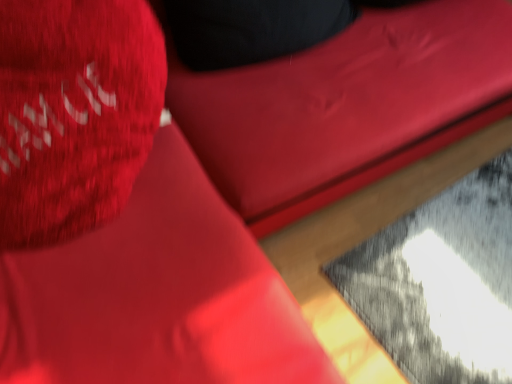
Question: Should I look upward or downward to see velvet-like red bean bag chair at upper center?

Choices:
 (A) down
 (B) up

Answer: (B)

Question: From a real-world perspective, is matte red throw pillow at upper left beneath velvet-like red bean bag chair at upper center?

Choices:
 (A) yes
 (B) no

Answer: (B)

Question: Is matte red throw pillow at upper left at the left side of velvet-like red bean bag chair at upper center?

Choices:
 (A) no
 (B) yes

Answer: (B)

Question: Does matte red throw pillow at upper left have a lesser width compared to velvet-like red bean bag chair at upper center?

Choices:
 (A) no
 (B) yes

Answer: (B)

Question: From a real-world perspective, is matte red throw pillow at upper left on top of velvet-like red bean bag chair at upper center?

Choices:
 (A) no
 (B) yes

Answer: (B)

Question: Does matte red throw pillow at upper left have a greater width compared to velvet-like red bean bag chair at upper center?

Choices:
 (A) yes
 (B) no

Answer: (B)

Question: Is matte red throw pillow at upper left behind velvet-like red bean bag chair at upper center?

Choices:
 (A) no
 (B) yes

Answer: (A)

Question: From a real-world perspective, is velvet-like red bean bag chair at upper center positioned under matte red throw pillow at upper left based on gravity?

Choices:
 (A) yes
 (B) no

Answer: (A)

Question: Are velvet-like red bean bag chair at upper center and matte red throw pillow at upper left beside each other?

Choices:
 (A) yes
 (B) no

Answer: (B)

Question: Does velvet-like red bean bag chair at upper center come in front of matte red throw pillow at upper left?

Choices:
 (A) yes
 (B) no

Answer: (B)

Question: Does velvet-like red bean bag chair at upper center have a larger size compared to matte red throw pillow at upper left?

Choices:
 (A) no
 (B) yes

Answer: (B)

Question: Can you confirm if velvet-like red bean bag chair at upper center is smaller than matte red throw pillow at upper left?

Choices:
 (A) yes
 (B) no

Answer: (B)

Question: Is velvet-like red bean bag chair at upper center shorter than matte red throw pillow at upper left?

Choices:
 (A) yes
 (B) no

Answer: (B)

Question: From the image's perspective, is matte red throw pillow at upper left positioned above or below velvet-like red bean bag chair at upper center?

Choices:
 (A) above
 (B) below

Answer: (B)